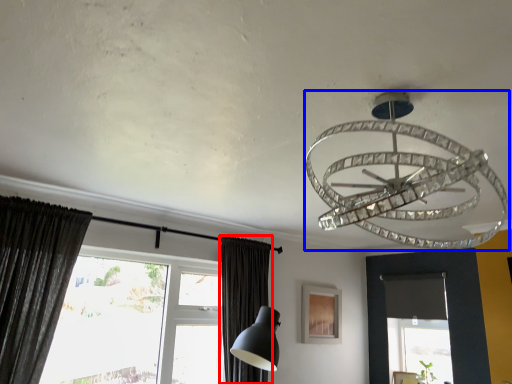
Question: Which point is further to the camera, curtain (highlighted by a red box) or lamp (highlighted by a blue box)?

Choices:
 (A) curtain
 (B) lamp

Answer: (A)